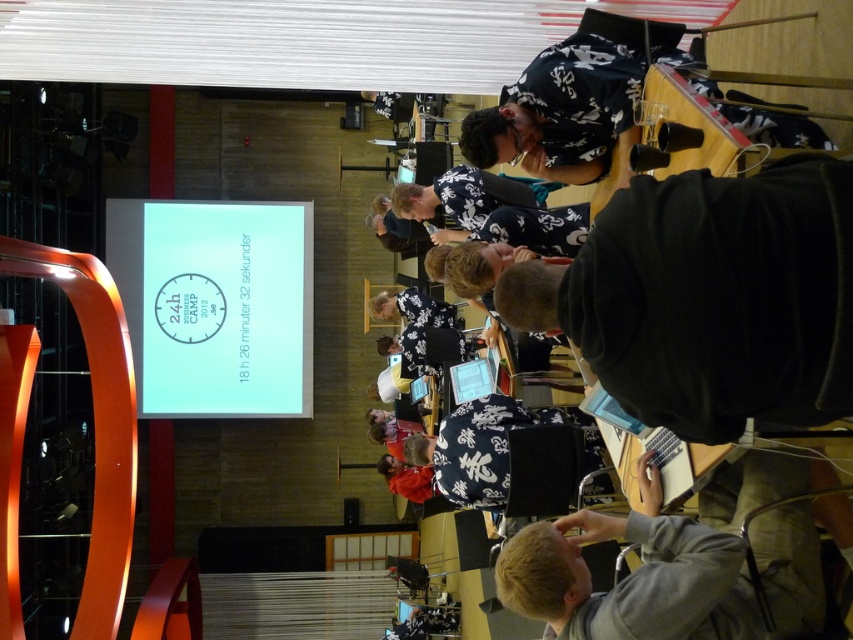
Can you confirm if floral fabric shirt at center is positioned below matte plastic screen at center?

Actually, floral fabric shirt at center is above matte plastic screen at center.

Between point (488, 202) and point (479, 387), which one is positioned in front?

Point (488, 202) is more forward.

Between point (421, 189) and point (459, 396), which one is positioned behind?

Point (421, 189)

Where is `floral fabric shirt at center`? floral fabric shirt at center is located at coordinates (461, 198).

Can you confirm if gray fabric at lower right is bigger than floral fabric shirt at center?

No.

Describe the element at coordinates (651, 564) in the screenshot. I see `gray fabric at lower right` at that location.

This screenshot has width=853, height=640. Find the location of `gray fabric at lower right`. gray fabric at lower right is located at coordinates (651, 564).

Between point (241, 365) and point (701, 515), which one is positioned in front?

Point (701, 515) is more forward.

Can you confirm if white glossy projection screen at upper left is positioned to the left of gray fabric at lower right?

Correct, you'll find white glossy projection screen at upper left to the left of gray fabric at lower right.

Is point (239, 380) more distant than point (503, 596)?

Yes, point (239, 380) is behind point (503, 596).

Where is `white glossy projection screen at upper left`? white glossy projection screen at upper left is located at coordinates (215, 305).